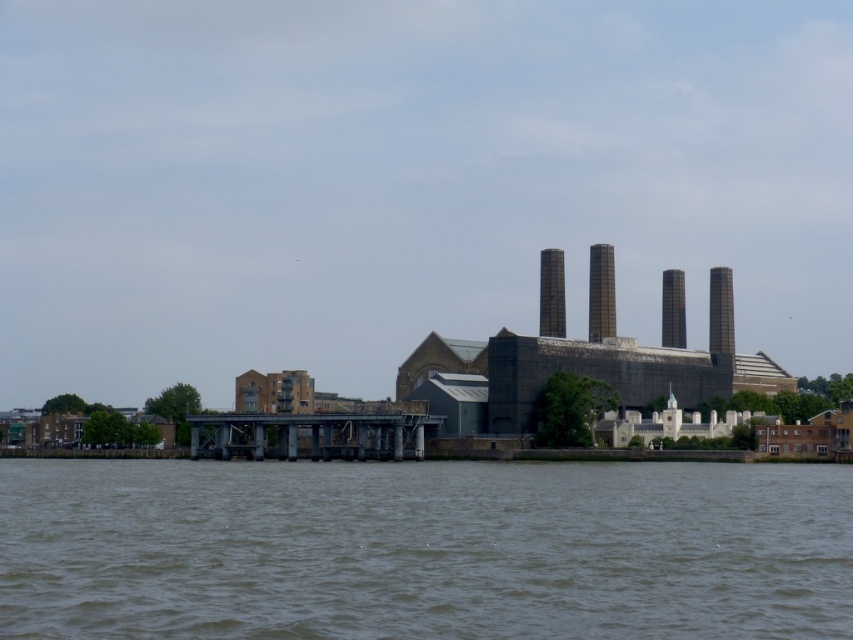
Looking at this image, does smooth metallic chimney at right appear under smooth gray chimney at center?

Yes.

Is smooth metallic chimney at right closer to camera compared to smooth gray chimney at center?

Yes.

Is point (711, 304) positioned after point (670, 275)?

That is True.

I want to click on smooth metallic chimney at right, so click(720, 310).

Is black glass chimney at center bigger than smooth gray chimney at center?

No, black glass chimney at center is not bigger than smooth gray chimney at center.

Between black glass chimney at center and smooth gray chimney at center, which one has more height?

With more height is black glass chimney at center.

Which is behind, point (548, 275) or point (683, 321)?

The point (683, 321) is more distant.

Where is `black glass chimney at center`? The width and height of the screenshot is (853, 640). black glass chimney at center is located at coordinates (550, 292).

Between black glass chimney at center and smooth metallic chimney at right, which one is positioned higher?

black glass chimney at center is higher up.

Does black glass chimney at center appear on the right side of smooth metallic chimney at right?

No, black glass chimney at center is not to the right of smooth metallic chimney at right.

Which is in front, point (561, 256) or point (709, 337)?

Point (561, 256) is more forward.

The image size is (853, 640). What are the coordinates of `black glass chimney at center` in the screenshot? It's located at (550, 292).